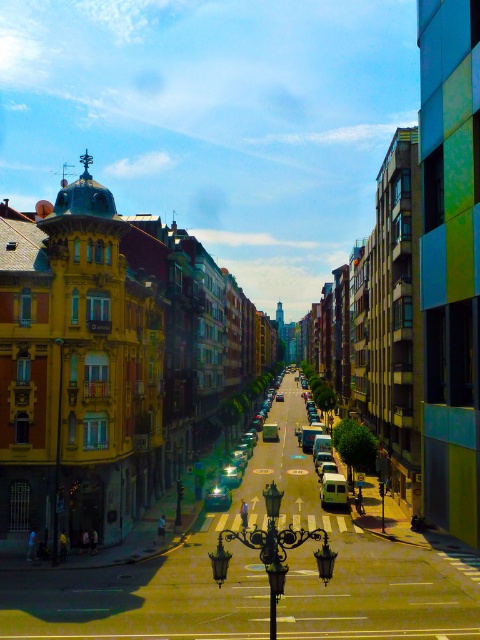
Based on the photo, who is positioned more to the left, shiny silver car at center or white matte van at center?

From the viewer's perspective, shiny silver car at center appears more on the left side.

Which is above, shiny silver car at center or white matte van at center?

white matte van at center is above.

What do you see at coordinates (247, 404) in the screenshot? I see `shiny silver car at center` at bounding box center [247, 404].

The width and height of the screenshot is (480, 640). Identify the location of shiny silver car at center. (247, 404).